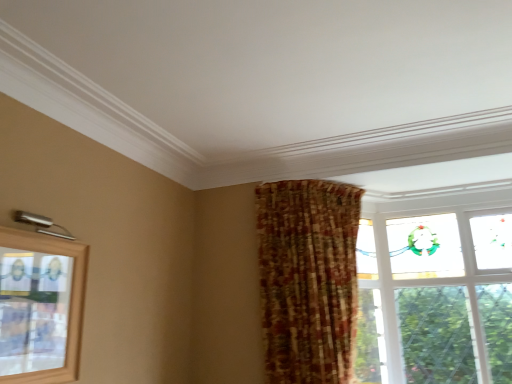
Question: Can you confirm if plaid fabric curtain at center is wider than clear glass window at upper left, placed as the 1th window when sorted from left to right?

Choices:
 (A) no
 (B) yes

Answer: (B)

Question: Does plaid fabric curtain at center have a lesser height compared to clear glass window at upper left, placed as the 1th window when sorted from left to right?

Choices:
 (A) yes
 (B) no

Answer: (B)

Question: Is plaid fabric curtain at center further to the viewer compared to clear glass window at upper left, positioned as the 2th window in back-to-front order?

Choices:
 (A) yes
 (B) no

Answer: (A)

Question: Is plaid fabric curtain at center facing away from clear glass window at upper left, which appears as the 1th window when viewed from the front?

Choices:
 (A) yes
 (B) no

Answer: (B)

Question: Can you confirm if plaid fabric curtain at center is positioned to the right of clear glass window at upper left, which appears as the 1th window when viewed from the front?

Choices:
 (A) yes
 (B) no

Answer: (A)

Question: Can you confirm if plaid fabric curtain at center is bigger than clear glass window at upper left, positioned as the 2th window in back-to-front order?

Choices:
 (A) yes
 (B) no

Answer: (A)

Question: Considering the relative sizes of clear glass window at upper left, placed as the 1th window when sorted from left to right, and clear glass window at upper right, the 1th window positioned from the back, in the image provided, is clear glass window at upper left, placed as the 1th window when sorted from left to right, shorter than clear glass window at upper right, the 1th window positioned from the back,?

Choices:
 (A) yes
 (B) no

Answer: (A)

Question: From the image's perspective, is clear glass window at upper left, which appears as the 1th window when viewed from the front, under clear glass window at upper right, which is the second window in left-to-right order?

Choices:
 (A) yes
 (B) no

Answer: (B)

Question: Would you say clear glass window at upper left, positioned as the 2th window in back-to-front order, contains clear glass window at upper right, which appears as the 2th window when viewed from the front?

Choices:
 (A) yes
 (B) no

Answer: (B)

Question: Considering the relative sizes of clear glass window at upper left, the 2th window viewed from the right, and clear glass window at upper right, which is the second window in left-to-right order, in the image provided, is clear glass window at upper left, the 2th window viewed from the right, bigger than clear glass window at upper right, which is the second window in left-to-right order,?

Choices:
 (A) yes
 (B) no

Answer: (B)

Question: Is clear glass window at upper left, placed as the 1th window when sorted from left to right, facing away from clear glass window at upper right, the 1th window positioned from the back?

Choices:
 (A) no
 (B) yes

Answer: (A)

Question: From a real-world perspective, is clear glass window at upper left, which appears as the 1th window when viewed from the front, over clear glass window at upper right, which appears as the 2th window when viewed from the front?

Choices:
 (A) no
 (B) yes

Answer: (A)

Question: Is clear glass window at upper right, placed as the first window when sorted from right to left, thinner than clear glass window at upper left, the 2th window viewed from the right?

Choices:
 (A) no
 (B) yes

Answer: (A)